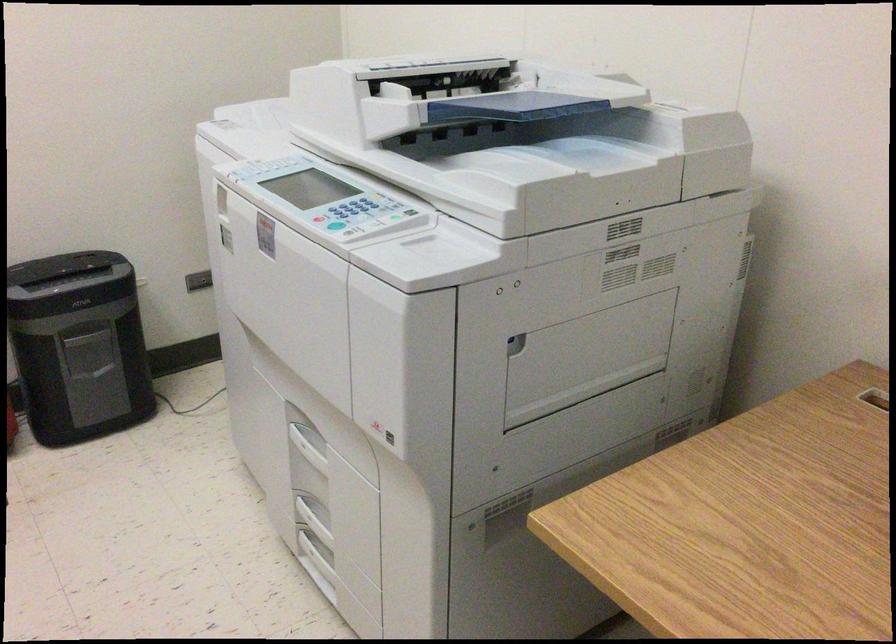
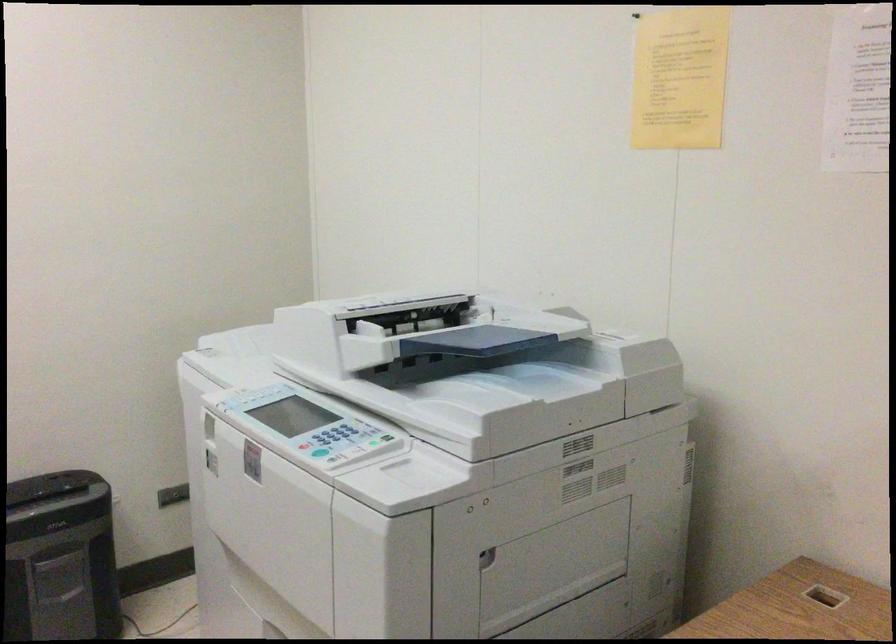
Question: In a continuous first-person perspective shot, in which direction is the camera moving?

Choices:
 (A) Left
 (B) Right
 (C) Forward
 (D) Backward

Answer: (D)